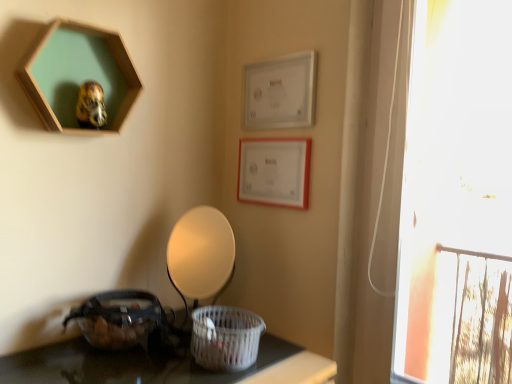
Locate an element on the screen. free space above wooden hexagon at upper left, the 1th picture frame from the left (from a real-world perspective) is located at coordinates (77, 26).